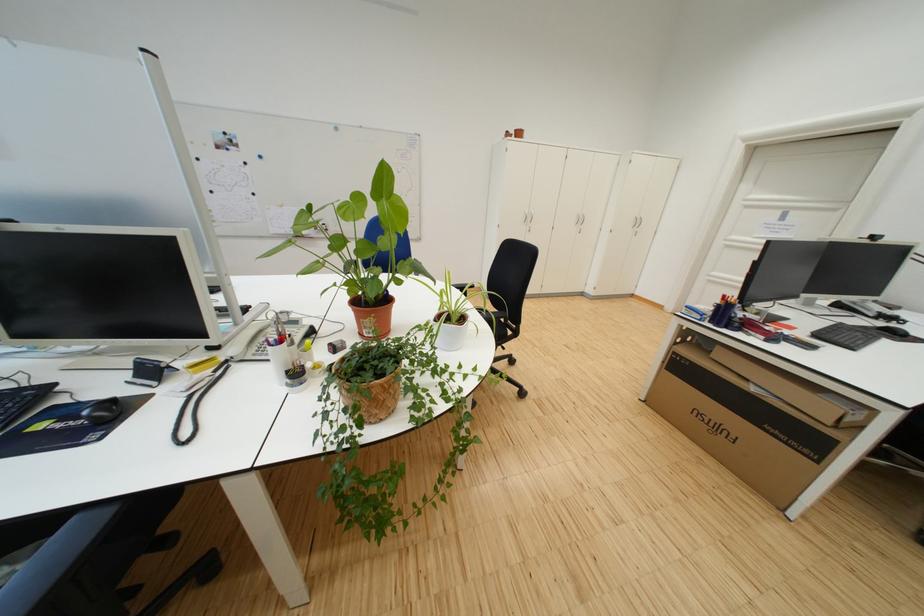
This screenshot has width=924, height=616. I want to click on black chair sitting surface, so click(494, 322).